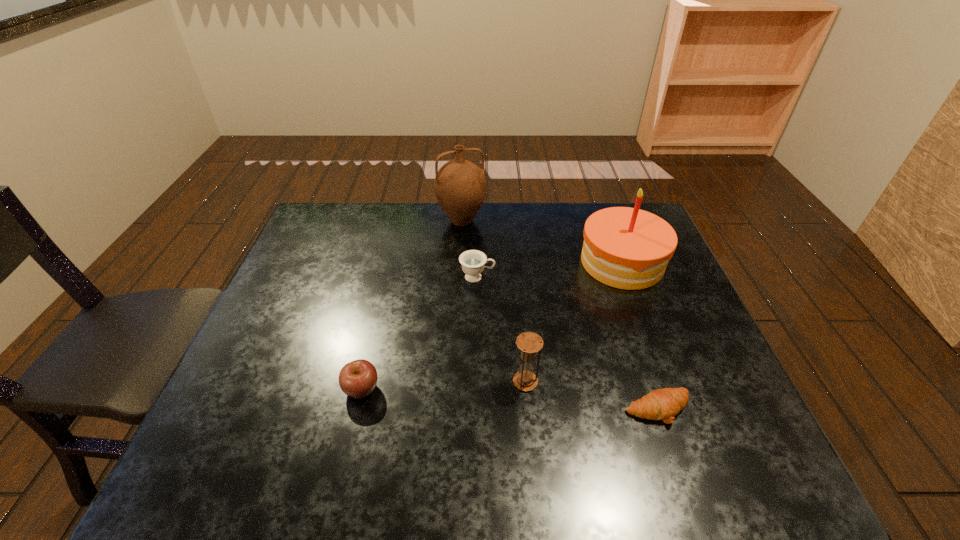
You are a GUI agent. You are given a task and a screenshot of the screen. Output one action in this format:
    pyautogui.click(x=<x>, y=<y>)
    Task: Click on the free space between the apple and the third object from right to left
    The height and width of the screenshot is (540, 960).
    Given the screenshot: What is the action you would take?
    pyautogui.click(x=444, y=385)

At what (x,y) coordinates should I click in order to perform the action: click on free space that is in between the shortest object and the farthest object. Please return your answer as a coordinate pair (x, y). Image resolution: width=960 pixels, height=540 pixels. Looking at the image, I should click on (560, 315).

At what (x,y) coordinates should I click in order to perform the action: click on free point between the pitcher and the third object from right to left. Please return your answer as a coordinate pair (x, y). The height and width of the screenshot is (540, 960). Looking at the image, I should click on (493, 301).

Identify which object is the third nearest to the apple. Please provide its 2D coordinates. Your answer should be formatted as a tuple, i.e. [(x, y)], where the tuple contains the x and y coordinates of a point satisfying the conditions above.

[(663, 404)]

Where is `object identified as the third closest to the shortest object`? object identified as the third closest to the shortest object is located at coordinates (473, 262).

This screenshot has width=960, height=540. I want to click on vacant region that satisfies the following two spatial constraints: 1. on the side of the crescent roll with the handle; 2. on the left side of the teacup, so click(x=476, y=409).

Where is `free space that satisfies the following two spatial constraints: 1. on the side of the teacup with the handle; 2. on the left side of the shortest object`? Image resolution: width=960 pixels, height=540 pixels. free space that satisfies the following two spatial constraints: 1. on the side of the teacup with the handle; 2. on the left side of the shortest object is located at coordinates (476, 409).

This screenshot has height=540, width=960. I want to click on vacant space that satisfies the following two spatial constraints: 1. on the back side of the shortest object; 2. on the side of the teacup with the handle, so click(614, 277).

Image resolution: width=960 pixels, height=540 pixels. What are the coordinates of `free space in the image that satisfies the following two spatial constraints: 1. on the front side of the birthday cake; 2. on the side of the leftmost object with the unique marking` in the screenshot? It's located at (669, 389).

What are the coordinates of `vacant point that satisfies the following two spatial constraints: 1. on the front side of the farthest object; 2. on the side of the leftmost object with the unique marking` in the screenshot? It's located at (453, 389).